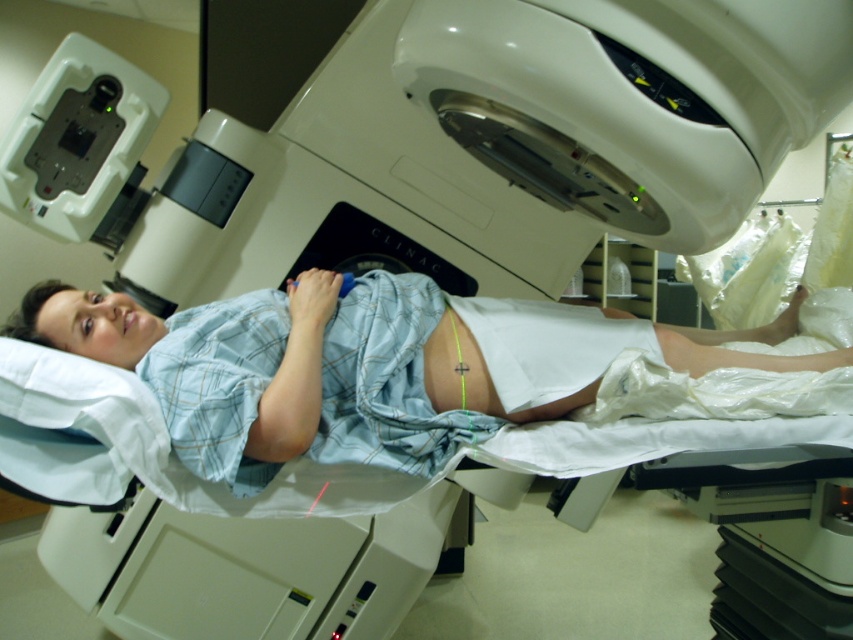
You are a radiation therapist preparing to align the patient for treatment. The LINAC machine requires that the treatment area must be directly under the machine. Given the positioning of the light blue plaid shirt at center and the matte skin at center, which object is closer to the center of the table where the LINAC will target?

The matte skin at center is closer to the center of the table because the light blue plaid shirt at center is positioned to the right of it, meaning the matte skin is centrally located under the LINAC machine.

You are a technician in a radiation therapy room. You need to ensure the white plastic device at upper left and the matte skin at center are positioned correctly. Which object is larger in size?

The white plastic device at upper left is larger in size compared to the matte skin at center.